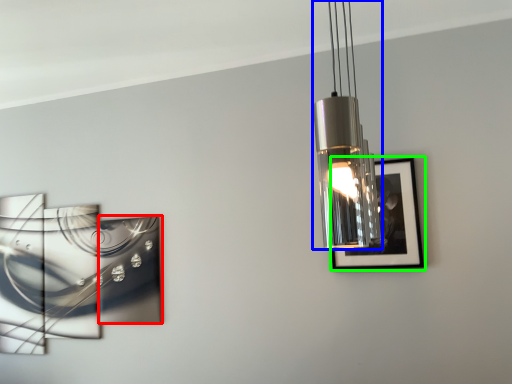
Question: Which object is positioned closest to picture frame (highlighted by a red box)? Select from lamp (highlighted by a blue box) and picture frame (highlighted by a green box).

Choices:
 (A) lamp
 (B) picture frame

Answer: (B)